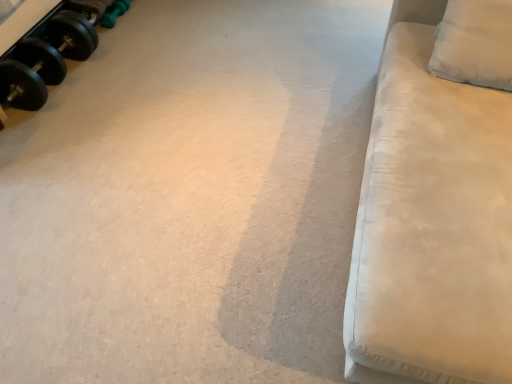
Question: Considering the positions of white fabric pillow at upper right and white fabric couch at right in the image, is white fabric pillow at upper right wider or thinner than white fabric couch at right?

Choices:
 (A) thin
 (B) wide

Answer: (A)

Question: Visually, is white fabric pillow at upper right positioned to the left or to the right of white fabric couch at right?

Choices:
 (A) right
 (B) left

Answer: (A)

Question: Based on their relative distances, which object is nearer to the black rubber dumbbell at upper left, marked as the 2th dumbbell in a back-to-front arrangement?

Choices:
 (A) white fabric pillow at upper right
 (B) green rubber dumbbell at upper left, which appears as the first dumbbell when viewed from the back
 (C) white fabric couch at right

Answer: (B)

Question: Estimate the real-world distances between objects in this image. Which object is farther from the white fabric pillow at upper right?

Choices:
 (A) white fabric couch at right
 (B) black rubber dumbbell at upper left, marked as the 2th dumbbell in a back-to-front arrangement
 (C) green rubber dumbbell at upper left, which appears as the first dumbbell when viewed from the back

Answer: (C)